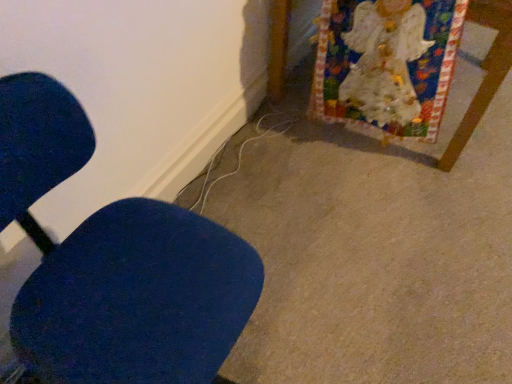
Question: Are white paper at upper right and blue fabric chair at left beside each other?

Choices:
 (A) yes
 (B) no

Answer: (B)

Question: Does white paper at upper right have a greater width compared to blue fabric chair at left?

Choices:
 (A) no
 (B) yes

Answer: (B)

Question: Is white paper at upper right bigger than blue fabric chair at left?

Choices:
 (A) no
 (B) yes

Answer: (B)

Question: Can you confirm if white paper at upper right is shorter than blue fabric chair at left?

Choices:
 (A) yes
 (B) no

Answer: (A)

Question: Is white paper at upper right smaller than blue fabric chair at left?

Choices:
 (A) yes
 (B) no

Answer: (B)

Question: From a real-world perspective, is white paper at upper right under blue fabric chair at left?

Choices:
 (A) no
 (B) yes

Answer: (B)

Question: Would you say blue fabric chair at left is outside white paper at upper right?

Choices:
 (A) yes
 (B) no

Answer: (A)

Question: Is blue fabric chair at left to the left of white paper at upper right from the viewer's perspective?

Choices:
 (A) no
 (B) yes

Answer: (B)

Question: Does blue fabric chair at left turn towards white paper at upper right?

Choices:
 (A) no
 (B) yes

Answer: (A)

Question: Is blue fabric chair at left wider than white paper at upper right?

Choices:
 (A) no
 (B) yes

Answer: (A)

Question: Is blue fabric chair at left in contact with white paper at upper right?

Choices:
 (A) yes
 (B) no

Answer: (B)

Question: Is blue fabric chair at left positioned far away from white paper at upper right?

Choices:
 (A) yes
 (B) no

Answer: (A)

Question: Do you think white paper at upper right is within blue fabric chair at left, or outside of it?

Choices:
 (A) outside
 (B) inside

Answer: (A)